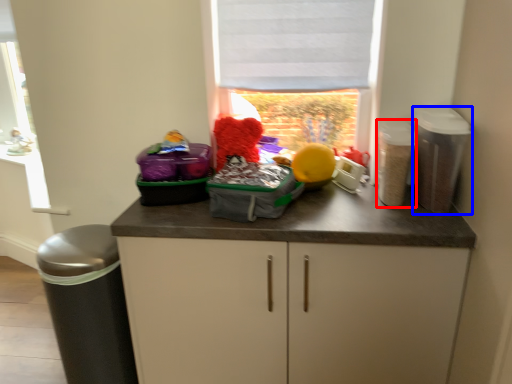
Question: Which object is closer to the camera taking this photo, appliance (highlighted by a red box) or appliance (highlighted by a blue box)?

Choices:
 (A) appliance
 (B) appliance

Answer: (B)